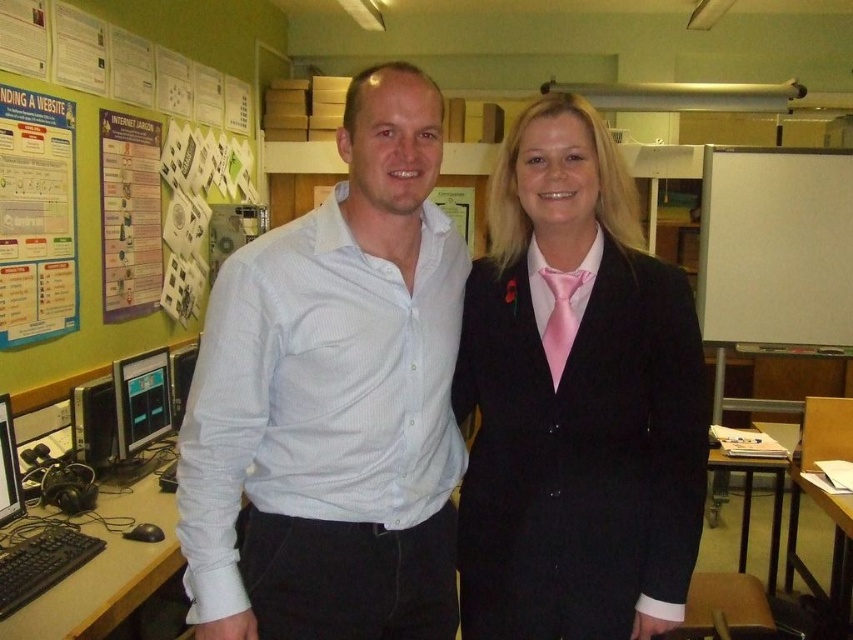
You are an office worker who needs to present a document. You are standing in front of the white matte board at right and the black glossy monitor at left. Which object should you write on to ensure your presentation is visible to everyone in the room?

You should write on the white matte board at right because it is positioned to the right of the black glossy monitor at left, making it more visible to the audience in the room.

You are standing in an office and see a point marked at coordinates (334, 401). According to the image, what object is located at that point?

The point at coordinates (334, 401) indicates the white cotton shirt at center.